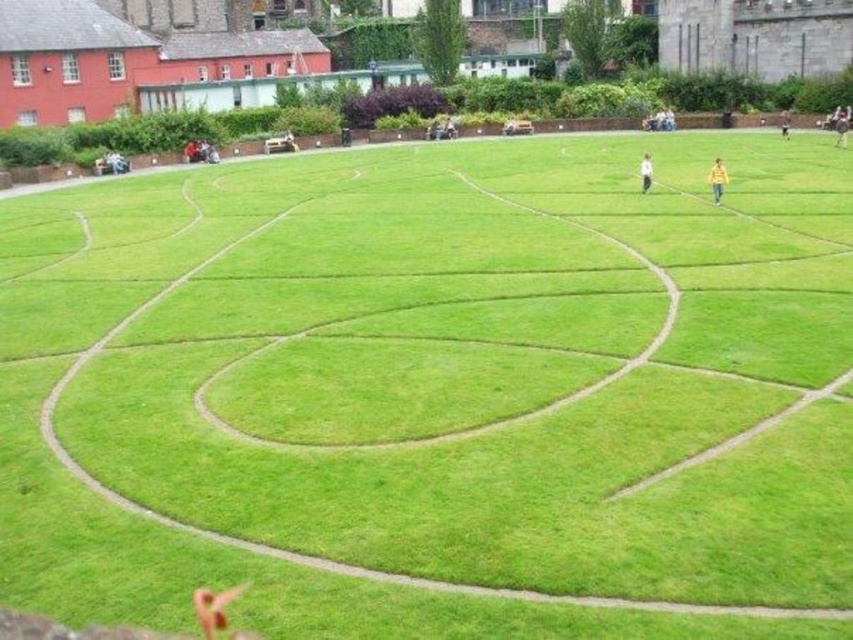
Consider the image. You are planning to place two fabric people in the maze. The white fabric person at center and the yellow fabric person at right must be positioned so that their widths are proportional to their sizes. Given that the maze paths are narrow, which person should be placed in the narrower path to ensure they fit without overlapping?

The white fabric person at center has a smaller width than the yellow fabric person at right, so it should be placed in the narrower maze path to ensure proper fit without overlapping.

You are standing at the entrance of the maze and see the white fabric person at center and the brown leather jacket at upper right. Which object is closer to the maze entrance?

The white fabric person at center is closer to the maze entrance because it is positioned to the left of the brown leather jacket at upper right, which is further away.